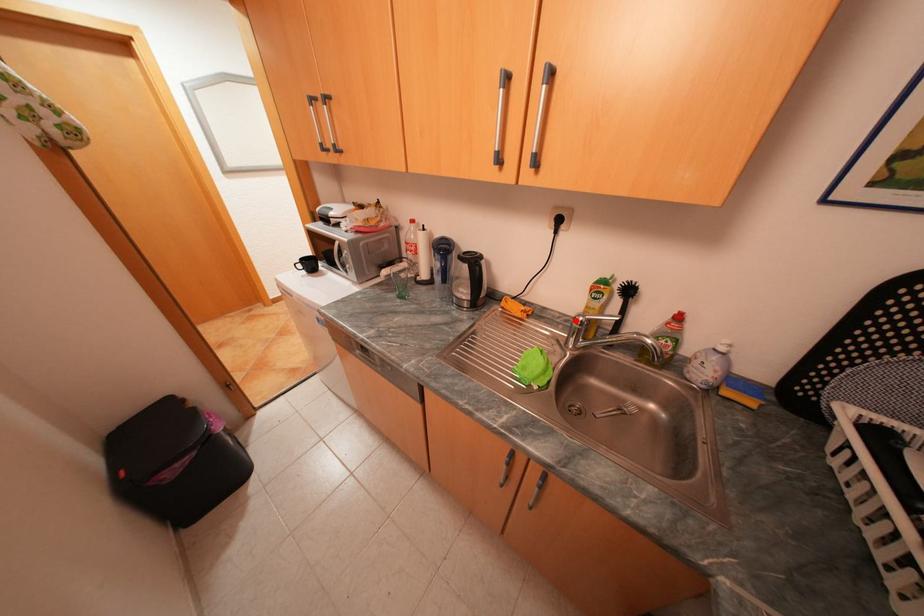
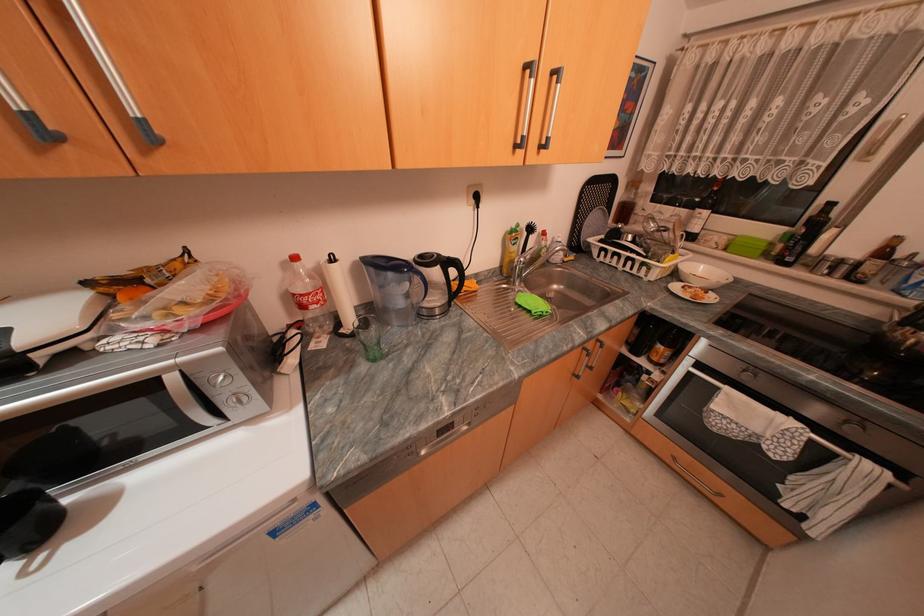
Locate, in the second image, the point that corresponds to the highlighted location in the first image.

(503, 273)